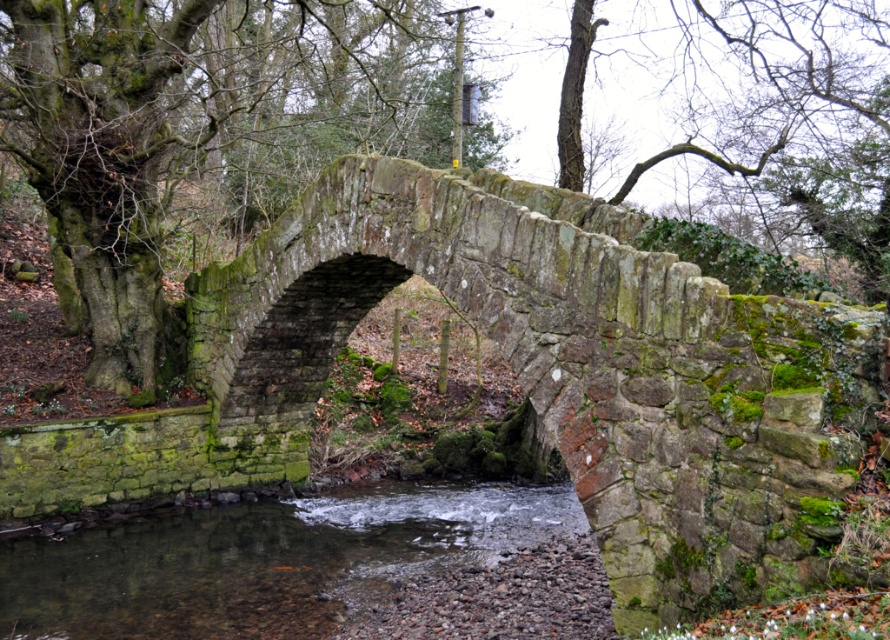
Is green mossy tree at center to the right of clear water at stream center from the viewer's perspective?

In fact, green mossy tree at center is to the left of clear water at stream center.

Who is more distant from viewer, (108, 349) or (81, 600)?

Positioned behind is point (108, 349).

You are a GUI agent. You are given a task and a screenshot of the screen. Output one action in this format:
    pyautogui.click(x=<x>, y=<y>)
    Task: Click on the green mossy tree at center
    
    Given the screenshot: What is the action you would take?
    pyautogui.click(x=200, y=129)

Which of these two, green mossy stone bridge at center or green mossy tree at center, stands taller?

Standing taller between the two is green mossy tree at center.

Is green mossy stone bridge at center above green mossy tree at center?

No.

The image size is (890, 640). What do you see at coordinates (552, 368) in the screenshot?
I see `green mossy stone bridge at center` at bounding box center [552, 368].

What are the coordinates of `green mossy stone bridge at center` in the screenshot? It's located at (552, 368).

Is point (277, 461) less distant than point (144, 596)?

No.

Is green mossy stone bridge at center further to camera compared to clear water at stream center?

No.

Is point (723, 481) positioned after point (122, 602)?

No.

This screenshot has width=890, height=640. Identify the location of green mossy stone bridge at center. (552, 368).